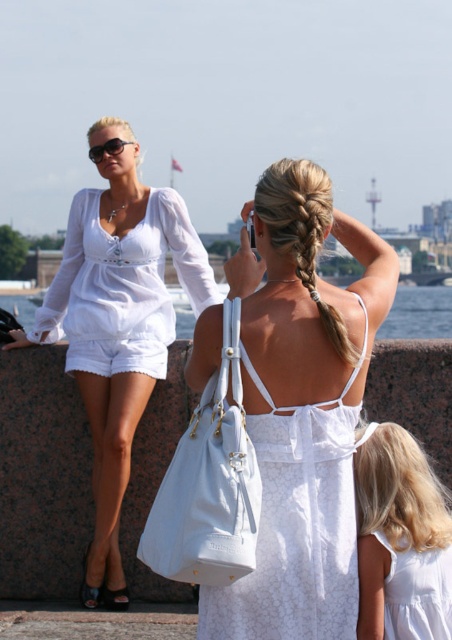
You are a photographer standing at the waterfront and see the white lace dress at center and the clear water at center. Which object is shorter in height?

The white lace dress at center is not as tall as the clear water at center, so the white lace dress at center is shorter in height.

You are a photographer trying to capture both the matte white blouse at center and the white lace dress at center in the same frame. Which one should you focus on first to ensure both are in focus?

You should focus on the matte white blouse at center first because it is closer to you than the white lace dress at center, ensuring both will be in focus when focused on the closer object.

From the picture: You are standing at the waterfront and want to take a photo of the point at coordinates point (x=128, y=336). Your camera has a maximum zoom range of 50 meters. Can you capture the point in focus without moving closer?

The point (x=128, y=336) is 45.09 meters away from the viewer. Since your camera can zoom up to 50 meters, you can capture the point in focus without moving closer.